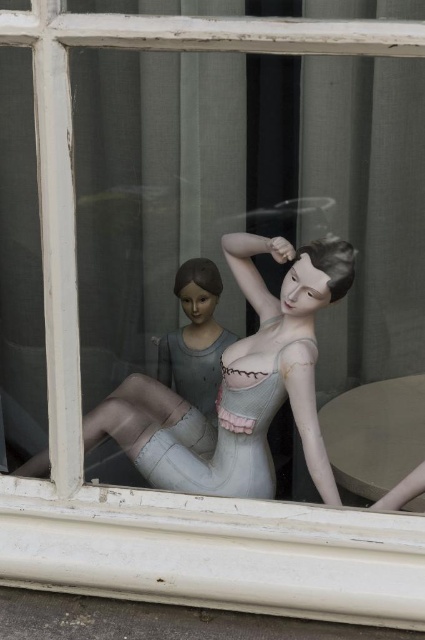
Question: Which point is farther from the camera taking this photo?

Choices:
 (A) (314, 513)
 (B) (195, 445)

Answer: (B)

Question: Among these points, which one is nearest to the camera?

Choices:
 (A) (371, 588)
 (B) (299, 332)

Answer: (A)

Question: Is matte white mannequin at center positioned in front of matte gray doll at center?

Choices:
 (A) no
 (B) yes

Answer: (B)

Question: Is white painted wood at lower center wider than matte gray doll at center?

Choices:
 (A) yes
 (B) no

Answer: (A)

Question: Based on their relative distances, which object is nearer to the white painted wood at lower center?

Choices:
 (A) matte gray doll at center
 (B) matte white mannequin at center

Answer: (B)

Question: Where is white painted wood at lower center located in relation to matte gray doll at center in the image?

Choices:
 (A) right
 (B) left

Answer: (A)